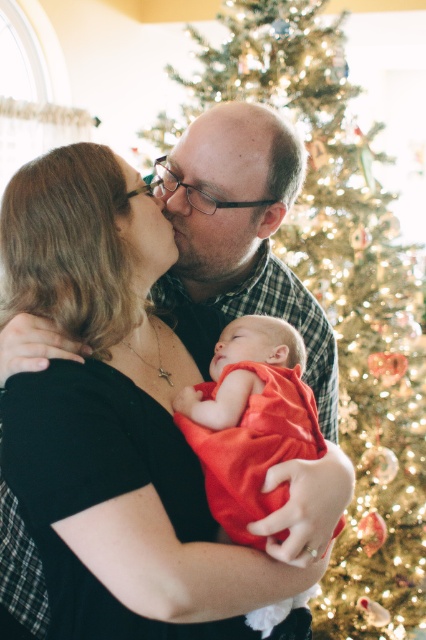
Question: Which point is farther from the camera taking this photo?

Choices:
 (A) (195, 164)
 (B) (383, 576)

Answer: (B)

Question: Can you confirm if shiny gold ornaments at upper center is positioned below matte black glasses at center?

Choices:
 (A) no
 (B) yes

Answer: (B)

Question: Is the position of shiny gold ornaments at upper center less distant than that of matte plaid shirt at center?

Choices:
 (A) no
 (B) yes

Answer: (A)

Question: Estimate the real-world distances between objects in this image. Which object is closer to the matte black nose at center?

Choices:
 (A) smooth bald head at center
 (B) matte plaid shirt at center
 (C) matte black glasses at center
 (D) silky red swaddle at center

Answer: (B)

Question: Can you confirm if shiny gold ornaments at upper center is positioned to the right of silky red swaddle at center?

Choices:
 (A) no
 (B) yes

Answer: (B)

Question: Which of the following is the closest to the observer?

Choices:
 (A) (123, 230)
 (B) (187, 595)

Answer: (B)